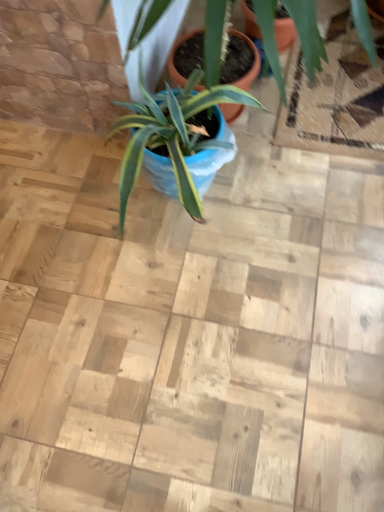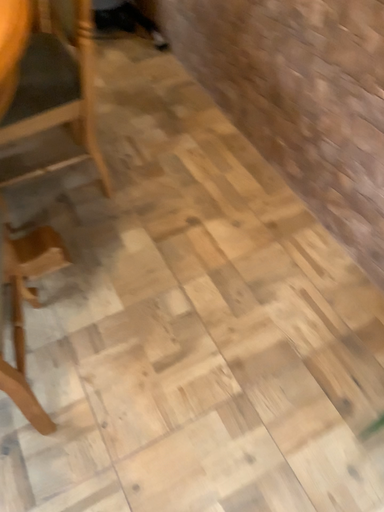
Question: How did the camera likely rotate when shooting the video?

Choices:
 (A) rotated left
 (B) rotated right

Answer: (A)